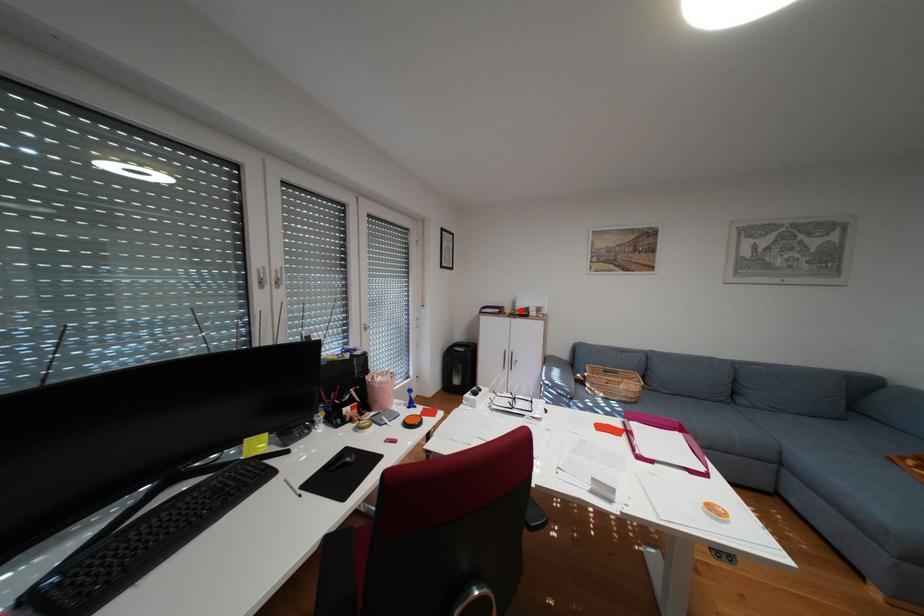
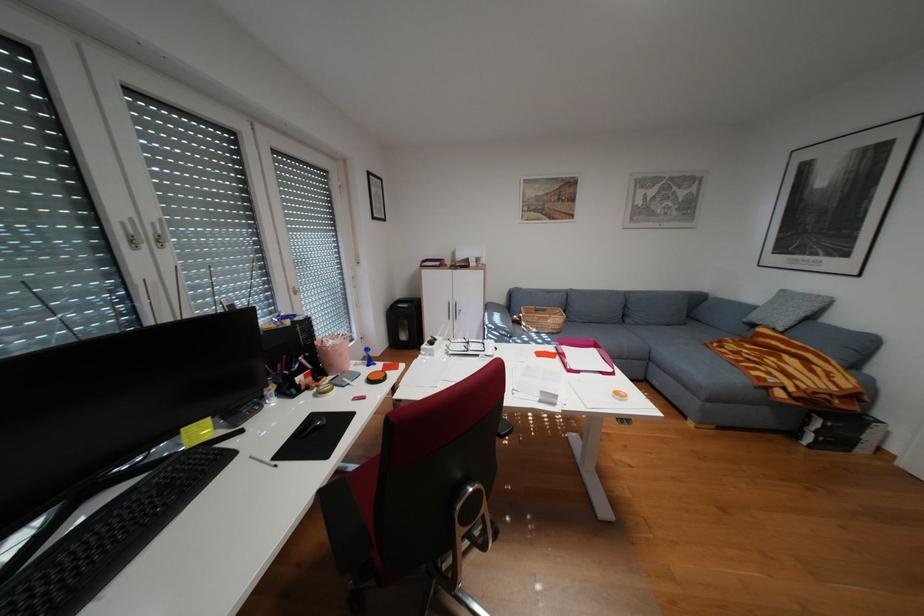
In the second image, find the point that corresponds to the highlighted location in the first image.

(460, 262)